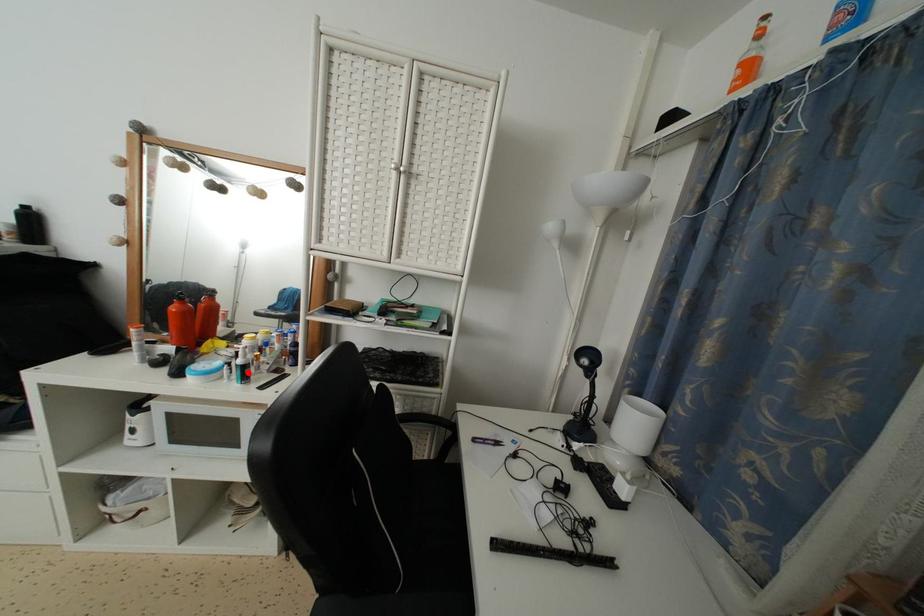
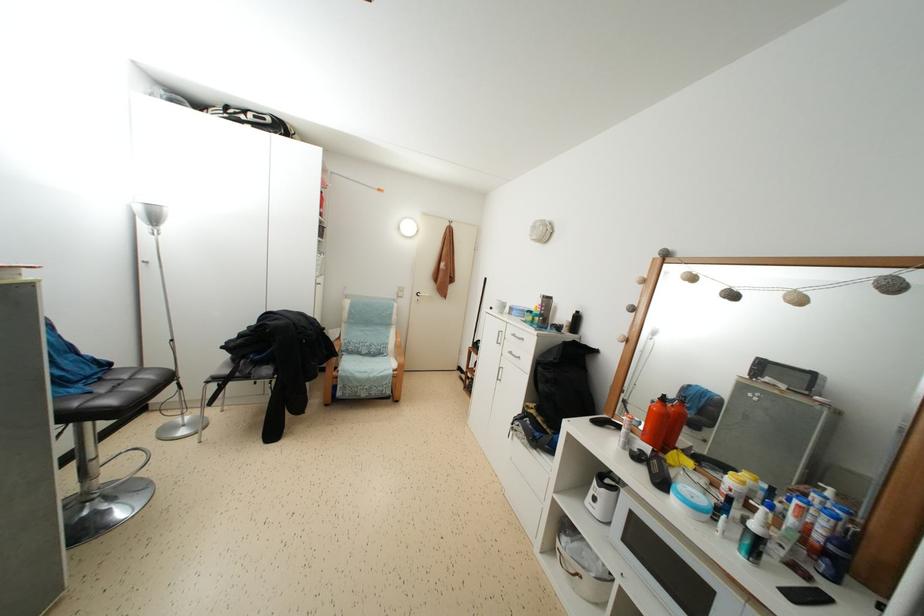
The point at the highlighted location is marked in the first image. Where is the corresponding point in the second image?

(763, 546)